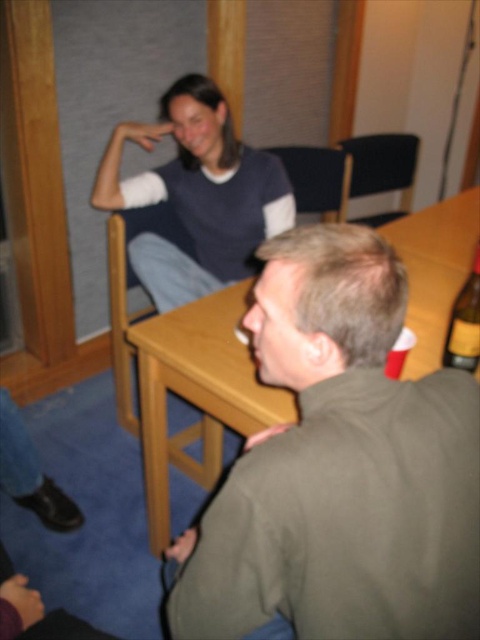
Is wooden chair at center to the left of yellow label glass bottle at table right from the viewer's perspective?

Correct, you'll find wooden chair at center to the left of yellow label glass bottle at table right.

Who is positioned more to the right, wooden chair at center or yellow label glass bottle at table right?

yellow label glass bottle at table right is more to the right.

Which is behind, point (130, 266) or point (466, 314)?

Point (130, 266)

The width and height of the screenshot is (480, 640). Identify the location of wooden chair at center. (126, 298).

Where is `green matte jacket at lower right`? green matte jacket at lower right is located at coordinates (340, 467).

Which is behind, point (442, 426) or point (175, 225)?

Point (175, 225)

Find the location of `green matte jacket at lower right`. green matte jacket at lower right is located at coordinates (340, 467).

Consider the image. Does wooden chair at center appear on the left side of black fabric chair at upper center?

Yes, wooden chair at center is to the left of black fabric chair at upper center.

This screenshot has height=640, width=480. What do you see at coordinates (126, 298) in the screenshot?
I see `wooden chair at center` at bounding box center [126, 298].

Is point (131, 220) behind point (265, 148)?

No, (131, 220) is in front of (265, 148).

Identify the location of wooden chair at center. pos(126,298).